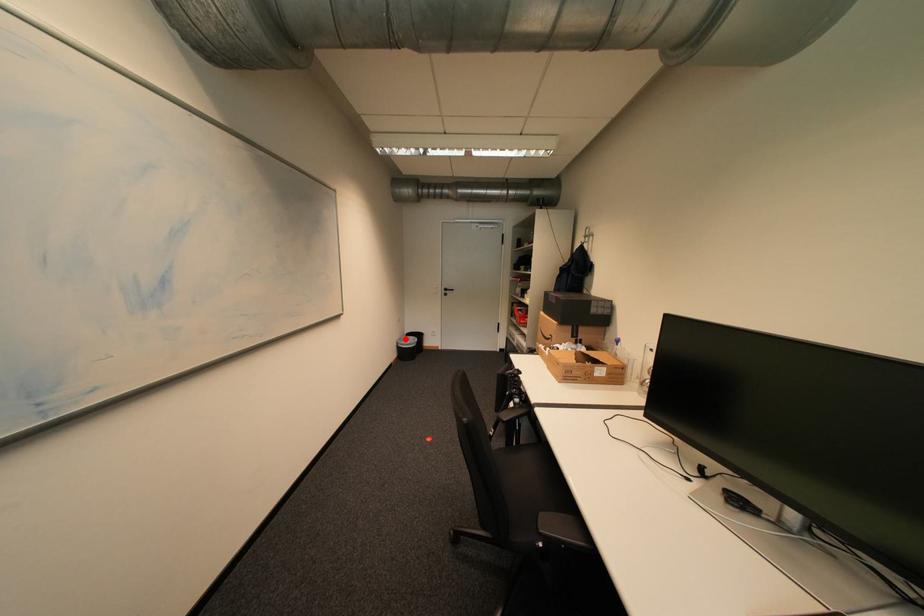
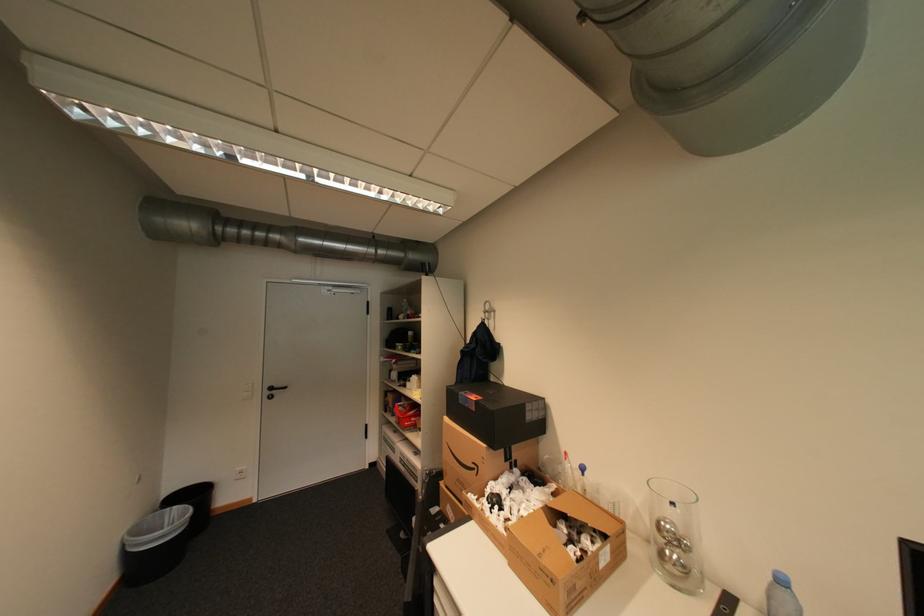
Question: I am providing you with two images of the same scene from different viewpoints. A red point is shown in image1. For the corresponding object point in image2, is it positioned nearer or farther from the camera?

Choices:
 (A) Nearer
 (B) Farther

Answer: (A)